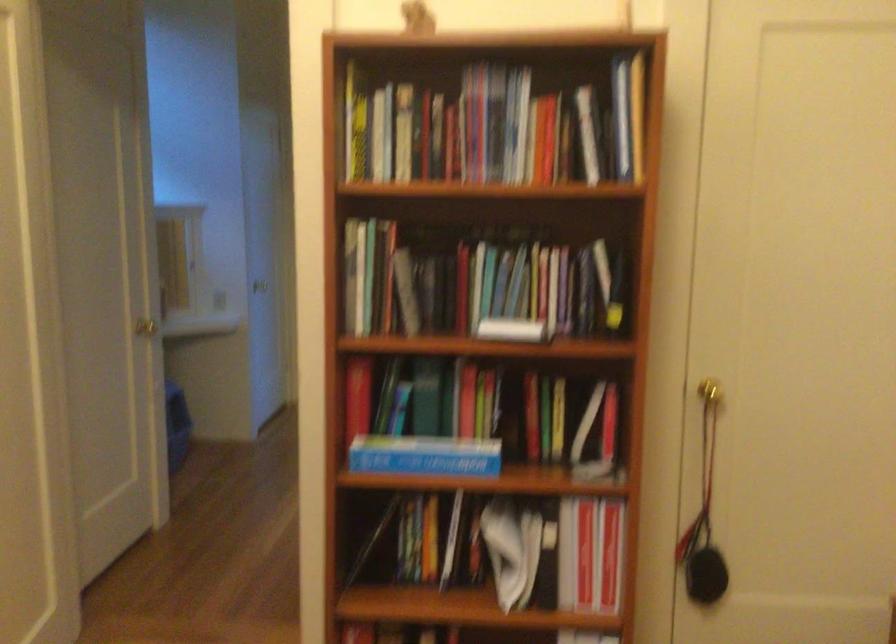
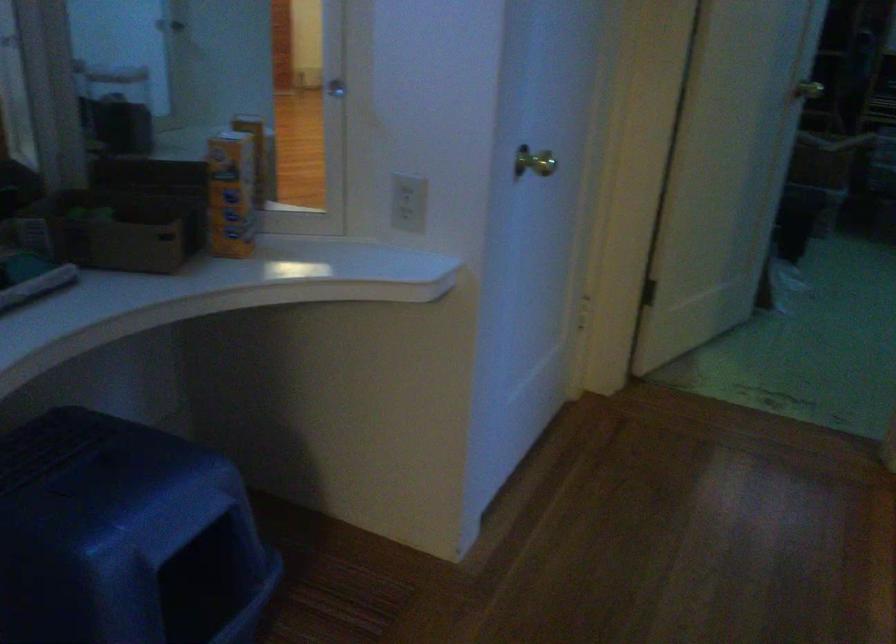
Locate, in the second image, the point that corresponds to the point at 229,297 in the first image.

(409, 202)